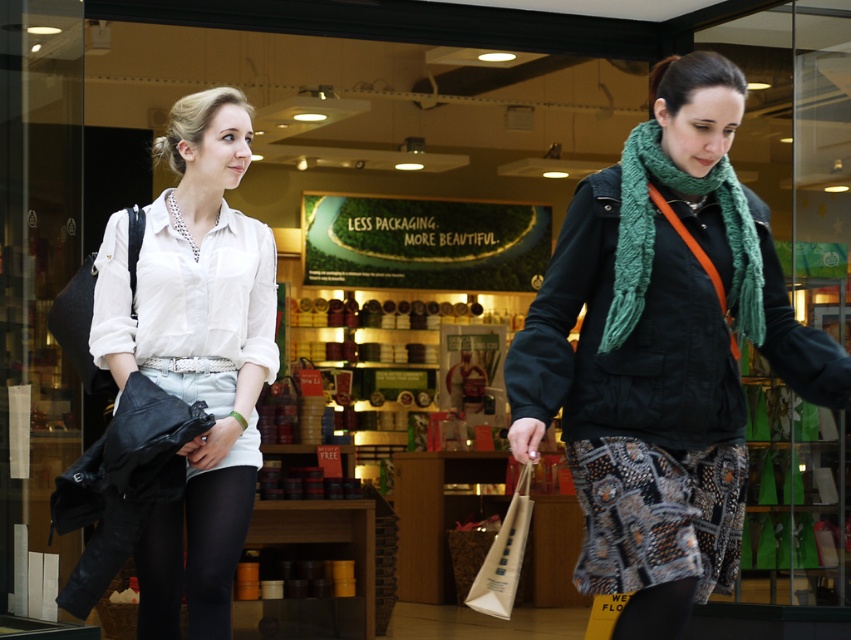
Does white matte shirt at center have a larger size compared to green knitted scarf at center?

Correct, white matte shirt at center is larger in size than green knitted scarf at center.

Consider the image. Who is positioned more to the right, white matte shirt at center or green knitted scarf at center?

green knitted scarf at center is more to the right.

Who is more distant from viewer, [227,349] or [644,180]?

Point [227,349]

In order to click on white matte shirt at center in this screenshot , I will do `click(195, 353)`.

Is green knitted scarf at center to the right of white paper bag at lower center from the viewer's perspective?

Indeed, green knitted scarf at center is positioned on the right side of white paper bag at lower center.

Does green knitted scarf at center appear on the left side of white paper bag at lower center?

Incorrect, green knitted scarf at center is not on the left side of white paper bag at lower center.

Between point (706, 180) and point (493, 563), which one is positioned in front?

Point (706, 180) is more forward.

Identify the location of green knitted scarf at center. The width and height of the screenshot is (851, 640). (654, 236).

Between point (161, 506) and point (710, 180), which one is positioned in front?

Positioned in front is point (710, 180).

Consider the image. Is the position of black tights at lower left less distant than that of green knitted scarf at center?

No.

Does point (206, 636) come closer to viewer compared to point (621, 275)?

No, (206, 636) is behind (621, 275).

What are the coordinates of `black tights at lower left` in the screenshot? It's located at (193, 556).